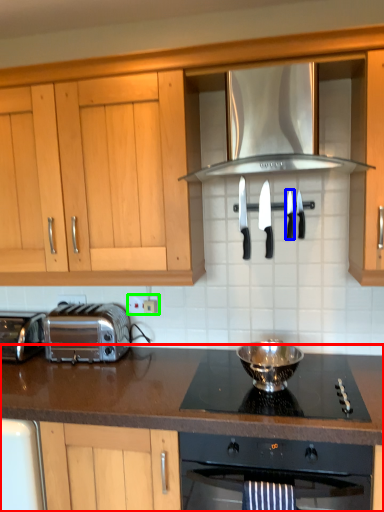
Question: Which object is the closest to the countertop (highlighted by a red box)? Choose among these: knife (highlighted by a blue box) or electric outlet (highlighted by a green box).

Choices:
 (A) knife
 (B) electric outlet

Answer: (B)